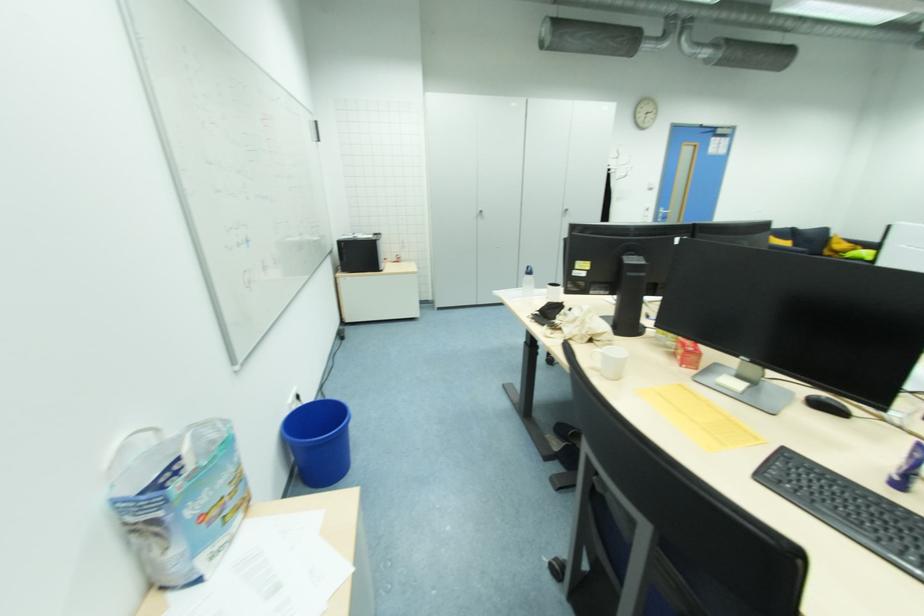
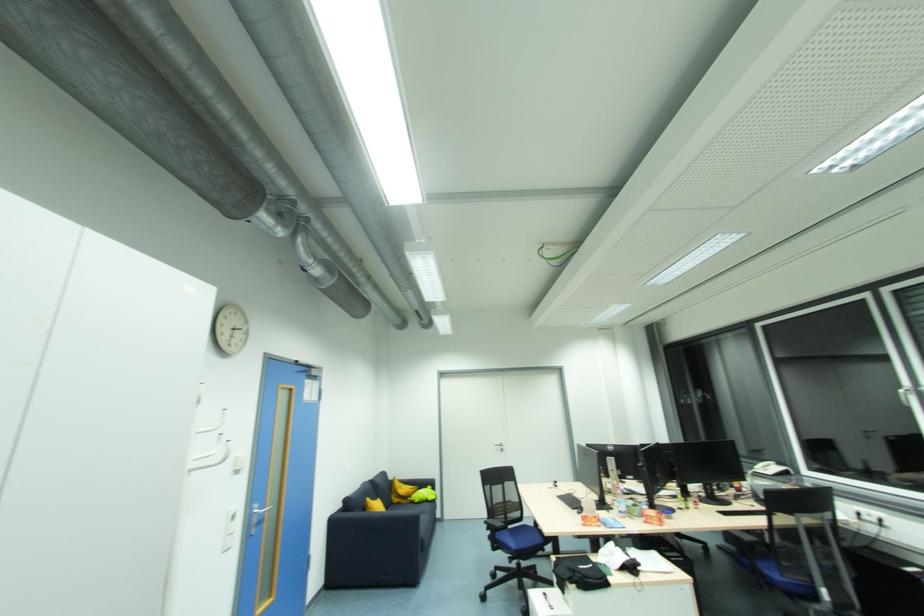
Question: I am providing you with two images of the same scene from different viewpoints. Which of the following objects are not visible in image2?

Choices:
 (A) yellow pillow
 (B) green pillow
 (C) white light switch
 (D) none of these

Answer: (D)